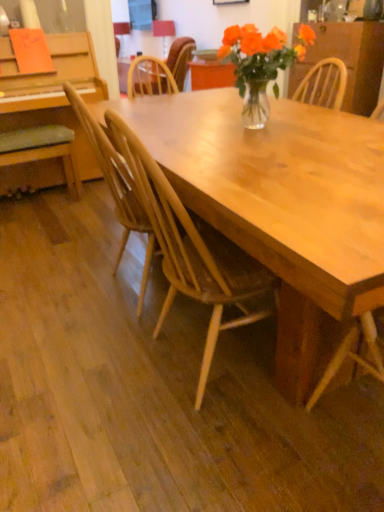
Question: Is wooden chair at center, which ranks as the 1th chair in back-to-front order, turned away from green fabric cushion at left, the 2th chair in the top-to-bottom sequence?

Choices:
 (A) no
 (B) yes

Answer: (A)

Question: Is wooden chair at center, which appears as the 4th chair when viewed from the front, touching green fabric cushion at left, positioned as the second chair in back-to-front order?

Choices:
 (A) no
 (B) yes

Answer: (A)

Question: From the image's perspective, is wooden chair at center, which appears as the 4th chair when viewed from the front, located beneath green fabric cushion at left, which is the 3th chair in bottom-to-top order?

Choices:
 (A) yes
 (B) no

Answer: (B)

Question: From a real-world perspective, is wooden chair at center, the first chair when ordered from top to bottom, physically below green fabric cushion at left, the 2th chair in the top-to-bottom sequence?

Choices:
 (A) no
 (B) yes

Answer: (A)

Question: Can you confirm if wooden chair at center, which ranks as the 1th chair in back-to-front order, is shorter than green fabric cushion at left, which appears as the 3th chair when viewed from the front?

Choices:
 (A) yes
 (B) no

Answer: (B)

Question: Can you confirm if wooden chair at center, which appears as the 4th chair when viewed from the front, is smaller than green fabric cushion at left, which appears as the 3th chair when viewed from the front?

Choices:
 (A) no
 (B) yes

Answer: (A)

Question: Is translucent glass vase at center positioned before light brown wood chair at center, the 3th chair positioned from the top?

Choices:
 (A) yes
 (B) no

Answer: (A)

Question: From the image's perspective, is translucent glass vase at center beneath light brown wood chair at center, which is the 3th chair from back to front?

Choices:
 (A) no
 (B) yes

Answer: (A)

Question: Is translucent glass vase at center positioned far away from light brown wood chair at center, the 2th chair positioned from the bottom?

Choices:
 (A) yes
 (B) no

Answer: (B)

Question: Can we say translucent glass vase at center lies outside light brown wood chair at center, the 2th chair positioned from the bottom?

Choices:
 (A) no
 (B) yes

Answer: (B)

Question: Does translucent glass vase at center have a greater height compared to light brown wood chair at center, the 2th chair positioned from the bottom?

Choices:
 (A) yes
 (B) no

Answer: (B)

Question: Is translucent glass vase at center to the right of light brown wood chair at center, which is the 3th chair from back to front, from the viewer's perspective?

Choices:
 (A) no
 (B) yes

Answer: (B)

Question: Can you confirm if light brown wood chair at center, the 3th chair positioned from the top, is taller than wooden chair at center, the first chair when ordered from top to bottom?

Choices:
 (A) no
 (B) yes

Answer: (B)